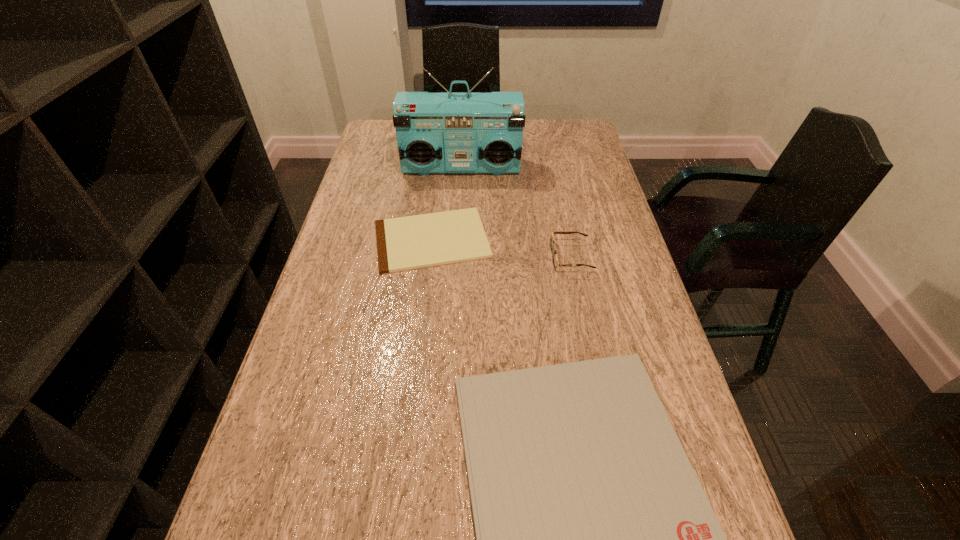
The image size is (960, 540). I want to click on radio receiver that is at the left edge, so click(x=445, y=132).

I want to click on clipboard at the left edge, so click(412, 242).

Locate an element on the screen. This screenshot has height=540, width=960. object located at the right edge is located at coordinates (555, 260).

I want to click on free space at the far edge, so tap(532, 129).

In the image, there is a desktop. At what (x,y) coordinates should I click in order to perform the action: click on vacant space at the left edge. Please return your answer as a coordinate pair (x, y). Looking at the image, I should click on pos(396,184).

Image resolution: width=960 pixels, height=540 pixels. I want to click on free space at the right edge of the desktop, so click(579, 267).

You are a GUI agent. You are given a task and a screenshot of the screen. Output one action in this format:
    pyautogui.click(x=<x>, y=<y>)
    Task: Click on the free space at the far left corner of the desktop
    
    Given the screenshot: What is the action you would take?
    tap(383, 138)

At what (x,y) coordinates should I click in order to perform the action: click on free space at the far right corner of the desktop. Please return your answer as a coordinate pair (x, y). The image size is (960, 540). Looking at the image, I should click on (565, 126).

The width and height of the screenshot is (960, 540). I want to click on vacant area that lies between the tallest object and the third shortest object, so click(516, 213).

Where is `unoccupied area between the second tallest object and the shorter clipboard`? This screenshot has height=540, width=960. unoccupied area between the second tallest object and the shorter clipboard is located at coordinates (501, 248).